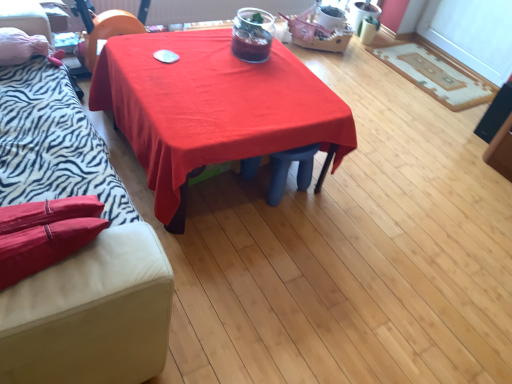
Question: In terms of size, does red fabric table at center appear bigger or smaller than zebra print fabric couch at left?

Choices:
 (A) big
 (B) small

Answer: (B)

Question: In terms of height, does red fabric table at center look taller or shorter compared to zebra print fabric couch at left?

Choices:
 (A) short
 (B) tall

Answer: (A)

Question: Which object is positioned farthest from the zebra print fabric couch at left?

Choices:
 (A) red fabric table at center
 (B) beige textured rug at right

Answer: (B)

Question: Which of these objects is positioned farthest from the zebra print fabric couch at left?

Choices:
 (A) red fabric table at center
 (B) beige textured rug at right

Answer: (B)